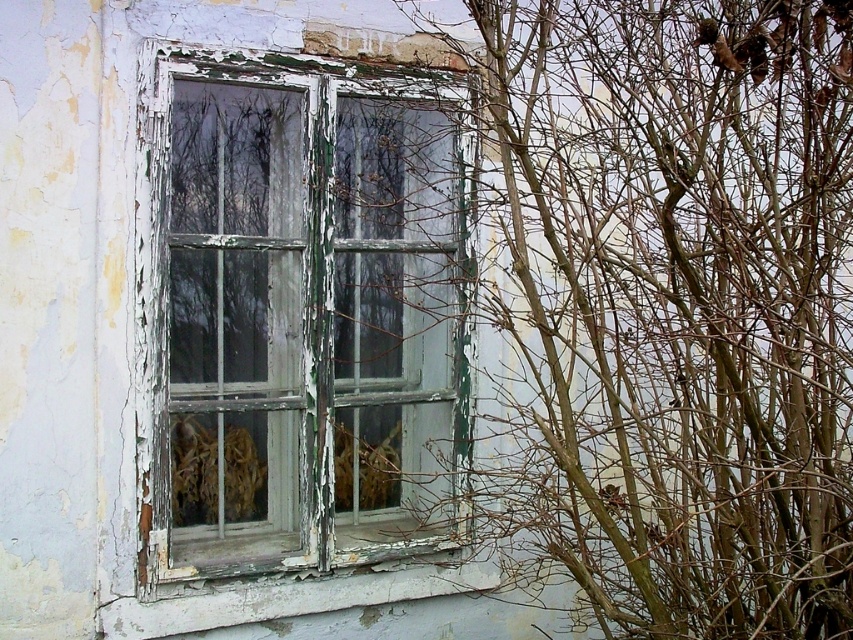
Question: Which point is farther to the camera?

Choices:
 (A) peeling white paint at lower center
 (B) bare branches at right
 (C) green peeling paint window at center

Answer: (A)

Question: Which point is farther to the camera?

Choices:
 (A) green peeling paint window at center
 (B) peeling white paint at lower center

Answer: (B)

Question: Observing the image, what is the correct spatial positioning of bare branches at right in reference to green peeling paint window at center?

Choices:
 (A) below
 (B) above

Answer: (B)

Question: Does bare branches at right appear on the left side of green peeling paint window at center?

Choices:
 (A) yes
 (B) no

Answer: (B)

Question: From the image, what is the correct spatial relationship of bare branches at right in relation to green peeling paint window at center?

Choices:
 (A) below
 (B) above

Answer: (B)

Question: Which object appears closest to the camera in this image?

Choices:
 (A) peeling white paint at lower center
 (B) bare branches at right

Answer: (B)